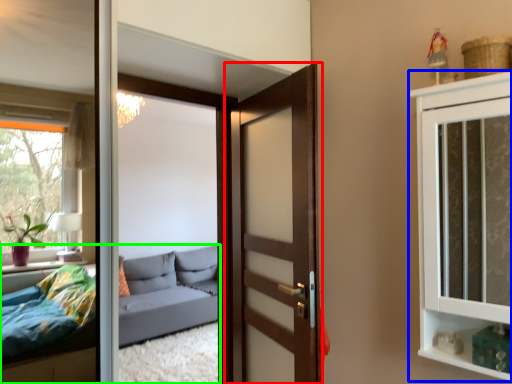
Question: Which is nearer to the door (highlighted by a red box)? cabinetry (highlighted by a blue box) or studio couch (highlighted by a green box).

Choices:
 (A) cabinetry
 (B) studio couch

Answer: (A)